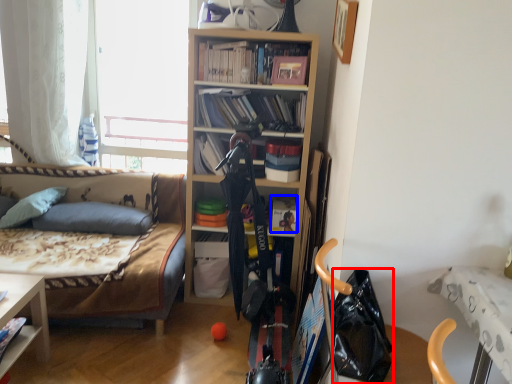
Question: Among these objects, which one is farthest to the camera, handbag (highlighted by a red box) or book (highlighted by a blue box)?

Choices:
 (A) handbag
 (B) book

Answer: (B)